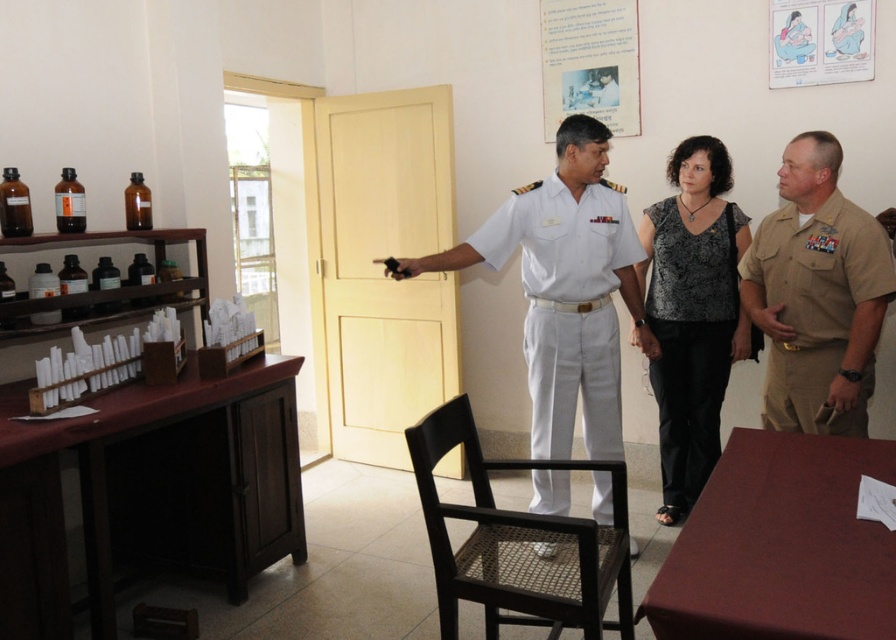
You are a patient in this office and need to locate the tan uniform shirt at right. According to the coordinates provided, where should you look in the room?

The tan uniform shirt at right is located at point (817, 294) in the room.